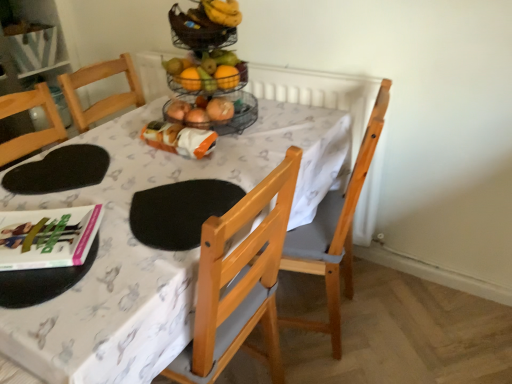
Locate an element on the screen. The height and width of the screenshot is (384, 512). free area in between black foam mat at upper left and orange plastic bag at center is located at coordinates (130, 166).